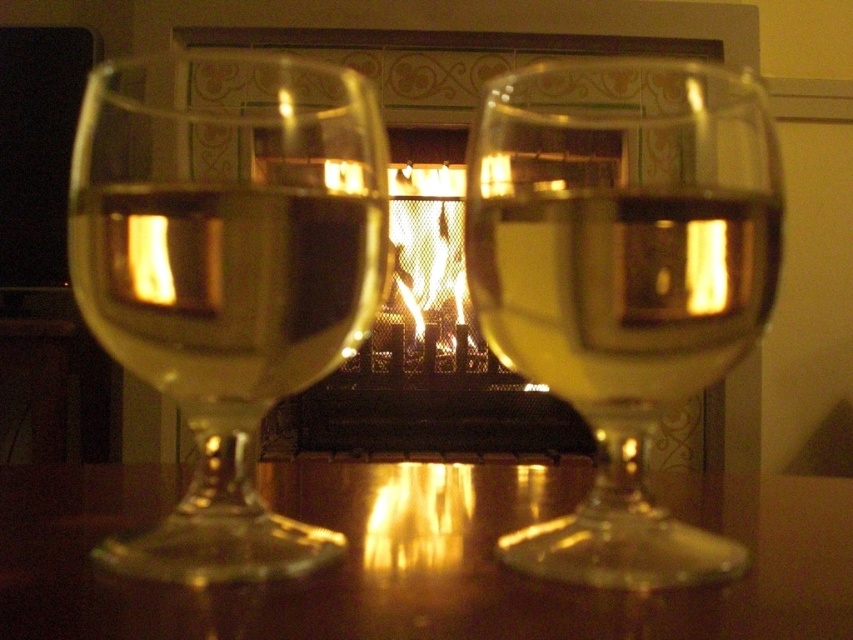
You are holding a small toy that is 10 inches long. You want to place it on the table where the glasses are located. Can you fit the entire toy on the table without it hanging off the edge near the point at coordinates point (602, 573)?

The distance from the point point (602, 573) to the camera is 9.97 inches. Since the toy is 10 inches long, placing it at that point would require at least 10 inches of space. However, the available space from that point to the edge is only 9.97 inches, so the toy would hang off by approximately 0.03 inches. Therefore, it might not fit entirely without overhanging.

You are a delivery person who needs to place a package between the translucent glass at center and the metallic mesh fireplace at center. The package is 1.5 meters long. Will it fit in the space between them?

The space between the translucent glass at center and the metallic mesh fireplace at center is 1.62 meters. Since the package is 1.5 meters long, it will fit as there is enough space.